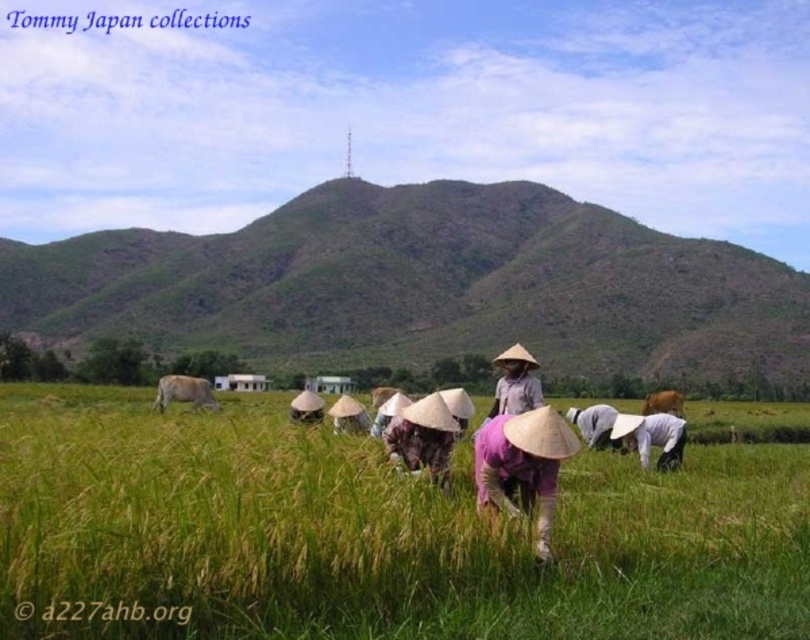
Can you confirm if green grassy rice field at center is thinner than brown fur at lower center?

In fact, green grassy rice field at center might be wider than brown fur at lower center.

Is green grassy rice field at center to the left of brown fur at lower center from the viewer's perspective?

Correct, you'll find green grassy rice field at center to the left of brown fur at lower center.

Is point (53, 582) in front of point (648, 406)?

Yes, it is in front of point (648, 406).

Locate an element on the screen. This screenshot has height=640, width=810. green grassy rice field at center is located at coordinates (373, 532).

Identify the location of green grassy rice field at center. (373, 532).

Does point (194, 518) lie in front of point (178, 396)?

Yes, point (194, 518) is in front of point (178, 396).

At what (x,y) coordinates should I click in order to perform the action: click on green grassy rice field at center. Please return your answer as a coordinate pair (x, y). The image size is (810, 640). Looking at the image, I should click on (373, 532).

Between green grassy rice field at center and purple fabric hat at center, which one is positioned lower?

green grassy rice field at center is lower down.

Is green grassy rice field at center below purple fabric hat at center?

Correct, green grassy rice field at center is located below purple fabric hat at center.

Is point (77, 406) more distant than point (565, 456)?

Yes.

Where is `green grassy rice field at center`? The width and height of the screenshot is (810, 640). green grassy rice field at center is located at coordinates (373, 532).